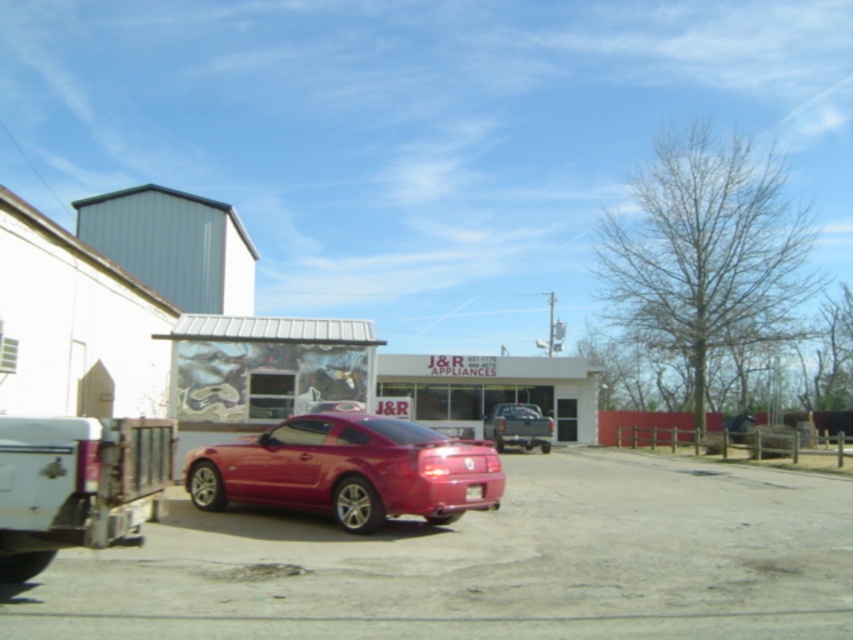
Measure the distance from white matte truck at lower left to matte black truck at center.

white matte truck at lower left is 85.76 feet from matte black truck at center.

Is white matte truck at lower left below matte black truck at center?

No.

Describe the element at coordinates (77, 484) in the screenshot. I see `white matte truck at lower left` at that location.

The width and height of the screenshot is (853, 640). In order to click on white matte truck at lower left in this screenshot , I will do `click(77, 484)`.

Can you confirm if glossy red car at center is smaller than white matte truck at lower left?

Yes.

Is point (486, 488) closer to camera compared to point (90, 513)?

No, it is behind (90, 513).

Where is `glossy red car at center`? glossy red car at center is located at coordinates (349, 470).

Is point (361, 468) farther from viewer compared to point (495, 420)?

No, (361, 468) is closer to viewer.

Between glossy red car at center and matte black truck at center, which one is positioned lower?

matte black truck at center is below.

Between point (335, 424) and point (521, 436), which one is positioned in front?

Positioned in front is point (335, 424).

Find the location of a particular element. glossy red car at center is located at coordinates (349, 470).